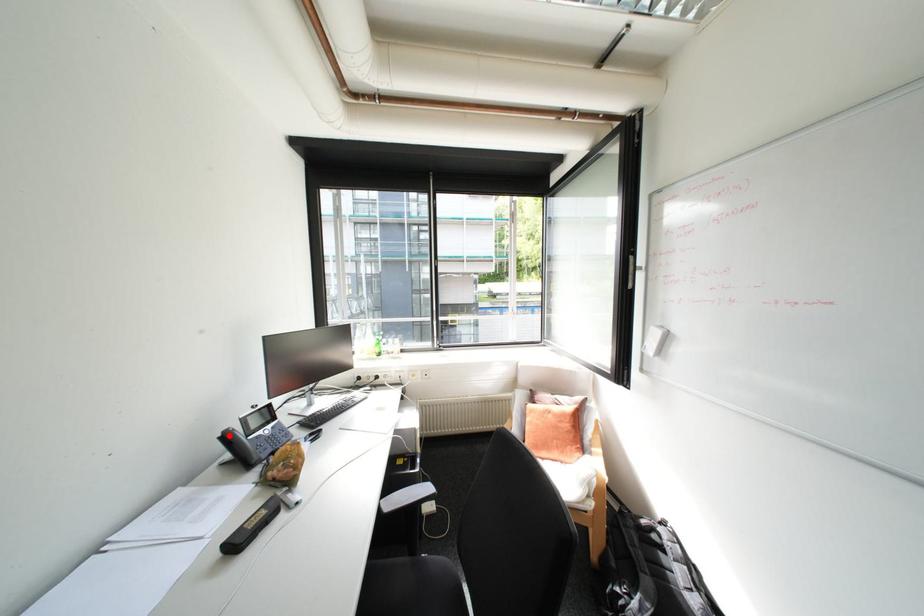
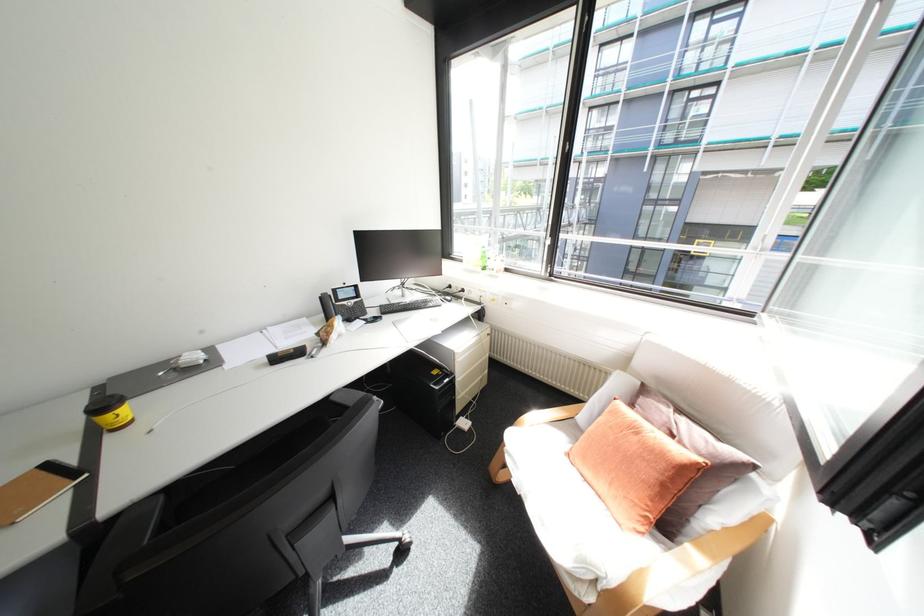
Locate, in the second image, the point that corresponds to the highlighted location in the first image.

(330, 296)